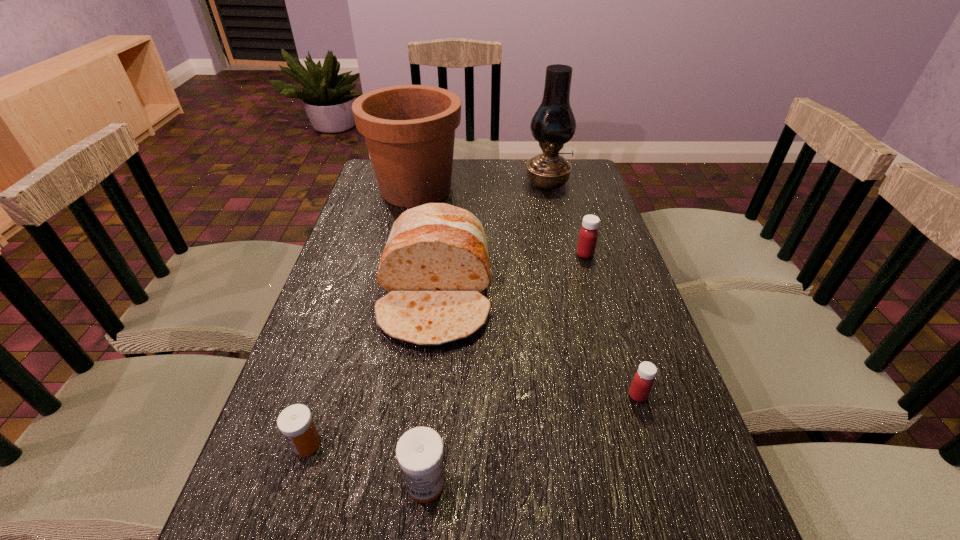
You are a GUI agent. You are given a task and a screenshot of the screen. Output one action in this format:
    pyautogui.click(x=<x>, y=<y>)
    Task: Click on the free space between the nearer red medicine and the brown oil lamp
    
    Given the screenshot: What is the action you would take?
    pyautogui.click(x=592, y=289)

The height and width of the screenshot is (540, 960). Identify the location of empty location between the smaller red medicine and the oil lamp. (592, 289).

Locate an element on the screen. The image size is (960, 540). free spot between the bigger red medicine and the fifth farthest object is located at coordinates (612, 325).

Find the location of `vacant area between the smaller red medicine and the bread`. vacant area between the smaller red medicine and the bread is located at coordinates (537, 345).

Image resolution: width=960 pixels, height=540 pixels. In order to click on free space that is in between the fifth farthest object and the farthest medicine in this screenshot , I will do `click(612, 325)`.

Find the location of a particular element. Image resolution: width=960 pixels, height=540 pixels. empty location between the smaller red medicine and the flowerpot is located at coordinates (527, 293).

Select which object appears as the third closest to the bigger white medicine. Please provide its 2D coordinates. Your answer should be formatted as a tuple, i.e. [(x, y)], where the tuple contains the x and y coordinates of a point satisfying the conditions above.

[(643, 380)]

At what (x,y) coordinates should I click in order to perform the action: click on object that is the fourth closest to the bigger white medicine. Please return your answer as a coordinate pair (x, y). Looking at the image, I should click on (588, 235).

Where is `medicine identified as the third closest to the flowerpot`? medicine identified as the third closest to the flowerpot is located at coordinates (295, 422).

Identify the location of medicine that is the third closest to the bigger red medicine. The width and height of the screenshot is (960, 540). (295, 422).